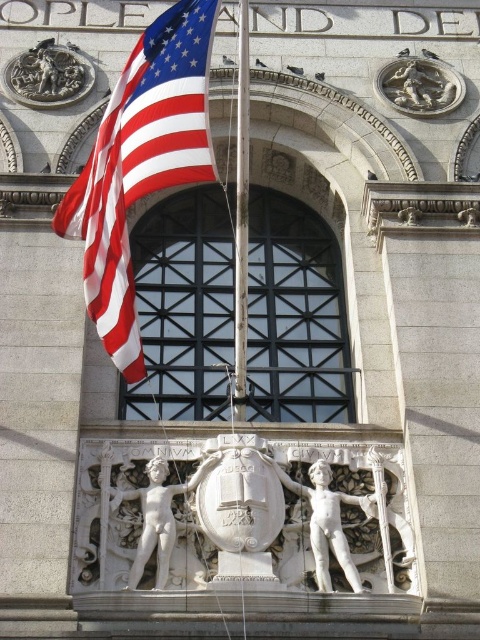
Question: Is white marble cherub at center above bronze relief at upper left?

Choices:
 (A) no
 (B) yes

Answer: (A)

Question: Among these objects, which one is farthest from the camera?

Choices:
 (A) red/white striped fabric at left
 (B) metallic pole at center
 (C) white marble statue at center
 (D) white marble cherub at center

Answer: (C)

Question: Does white marble statue at center have a lesser width compared to white marble cherub at center?

Choices:
 (A) no
 (B) yes

Answer: (B)

Question: Which of these objects is positioned farthest from the white marble statue at center?

Choices:
 (A) bronze relief at upper left
 (B) white marble cherub at center
 (C) silver metallic lion at upper right
 (D) red/white striped fabric at left

Answer: (A)

Question: Considering the relative positions of white marble cherub at center and silver metallic lion at upper right in the image provided, where is white marble cherub at center located with respect to silver metallic lion at upper right?

Choices:
 (A) below
 (B) above

Answer: (A)

Question: Estimate the real-world distances between objects in this image. Which object is farther from the bronze relief at upper left?

Choices:
 (A) metallic pole at center
 (B) silver metallic lion at upper right

Answer: (B)